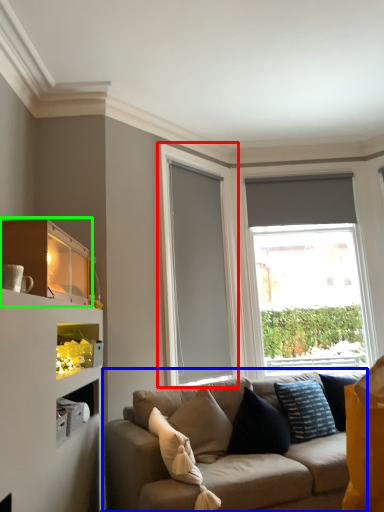
Question: Which object is positioned closest to glass door (highlighted by a red box)? Select from studio couch (highlighted by a blue box) and shelf (highlighted by a green box).

Choices:
 (A) studio couch
 (B) shelf

Answer: (A)